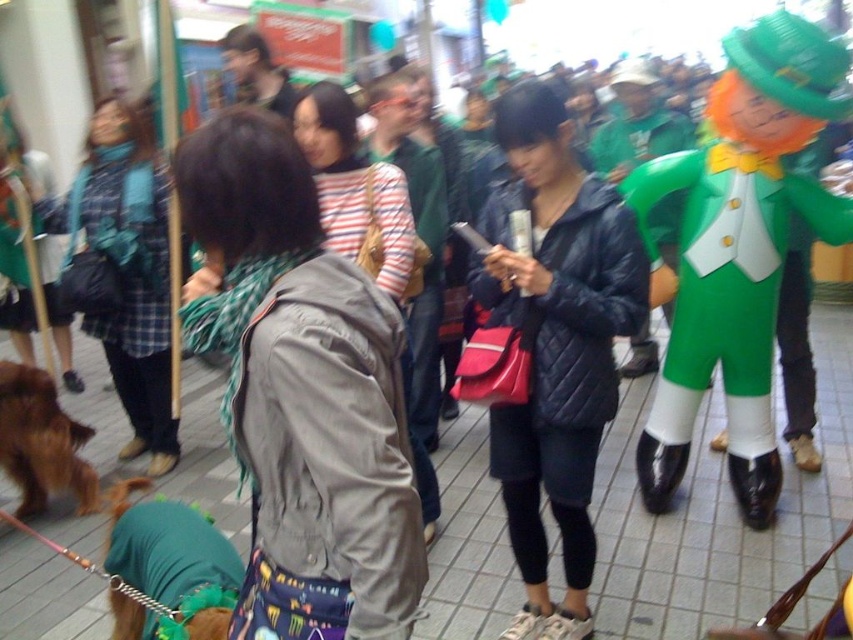
Question: Which point is farther from the camera taking this photo?

Choices:
 (A) (836, 209)
 (B) (401, 276)
 (C) (131, 188)

Answer: (C)

Question: Which object is farther from the camera taking this photo?

Choices:
 (A) striped fabric at center
 (B) matte gray jacket at center
 (C) green fabric costume at right
 (D) matte black jacket at center

Answer: (C)

Question: Can you confirm if matte black jacket at center is positioned to the right of striped fabric at center?

Choices:
 (A) yes
 (B) no

Answer: (A)

Question: Among these points, which one is nearest to the camera?

Choices:
 (A) (306, 490)
 (B) (138, 444)

Answer: (A)

Question: Can you confirm if matte gray jacket at center is thinner than striped fabric at center?

Choices:
 (A) yes
 (B) no

Answer: (A)

Question: Observing the image, what is the correct spatial positioning of matte black jacket at center in reference to plaid fabric jacket at left?

Choices:
 (A) below
 (B) above

Answer: (A)